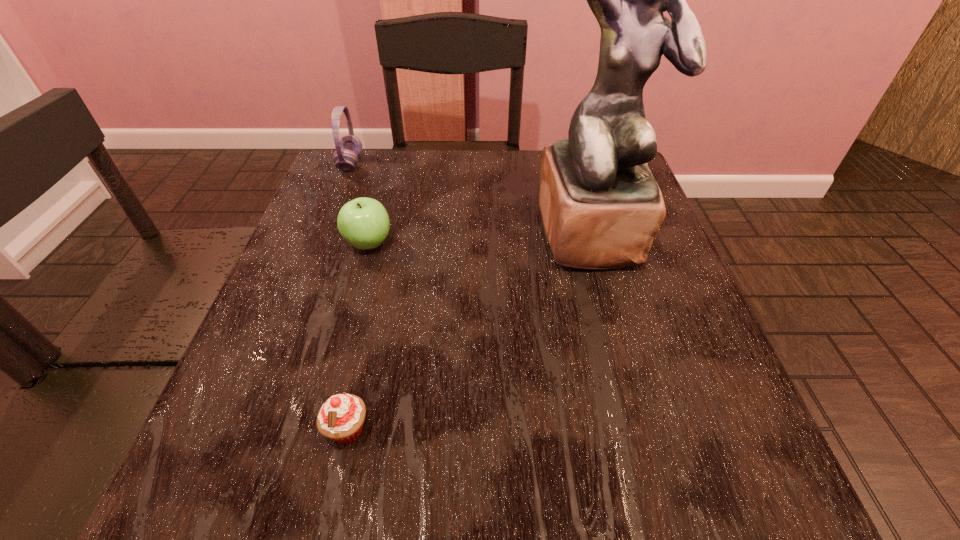
I want to click on vacant position located 0.330m on the back of the shortest object, so click(x=386, y=254).

Identify the location of sculpture located in the far edge section of the desktop. The width and height of the screenshot is (960, 540). (601, 207).

The image size is (960, 540). Identify the location of headset present at the far edge. (349, 147).

Image resolution: width=960 pixels, height=540 pixels. In order to click on object present at the near edge in this screenshot , I will do `click(341, 418)`.

Locate an element on the screen. The height and width of the screenshot is (540, 960). headset present at the left edge is located at coordinates (349, 147).

Where is `apple present at the left edge`? The image size is (960, 540). apple present at the left edge is located at coordinates (363, 222).

Locate an element on the screen. cupcake located in the left edge section of the desktop is located at coordinates (341, 418).

The width and height of the screenshot is (960, 540). What are the coordinates of `object present at the right edge` in the screenshot? It's located at (601, 207).

Where is `object at the far left corner`? The height and width of the screenshot is (540, 960). object at the far left corner is located at coordinates (349, 147).

Where is `object at the near left corner`? The image size is (960, 540). object at the near left corner is located at coordinates (341, 418).